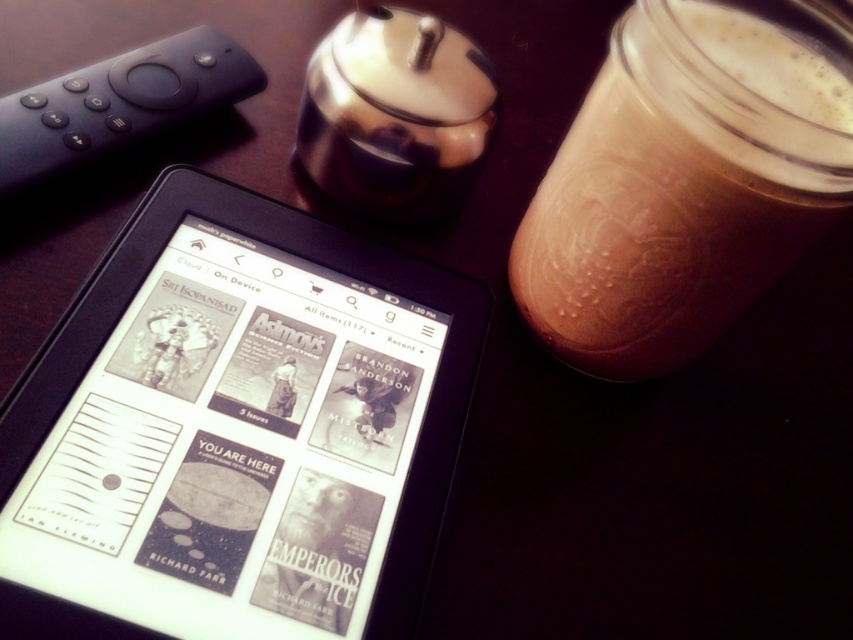
Can you confirm if black e-reader at center is smaller than brown matte glass jar at upper right?

Incorrect, black e-reader at center is not smaller in size than brown matte glass jar at upper right.

Who is positioned more to the left, black e-reader at center or brown matte glass jar at upper right?

black e-reader at center

Which is behind, point (56, 342) or point (576, 128)?

Point (576, 128)

At what (x,y) coordinates should I click in order to perform the action: click on black e-reader at center. Please return your answer as a coordinate pair (x, y). Looking at the image, I should click on (235, 429).